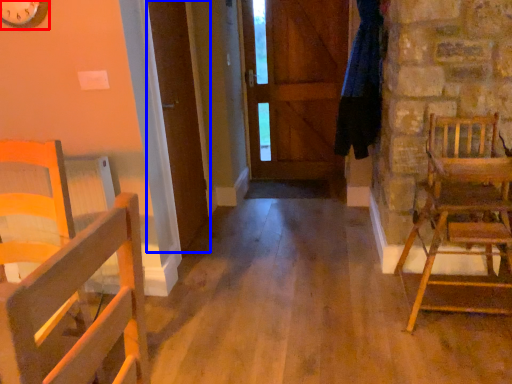
Question: Which object is closer to the camera taking this photo, clock (highlighted by a red box) or door (highlighted by a blue box)?

Choices:
 (A) clock
 (B) door

Answer: (A)